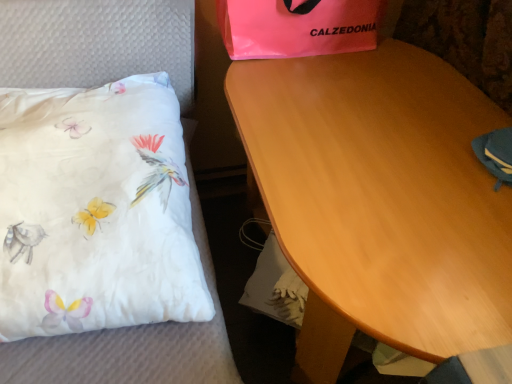
Question: From a real-world perspective, does white satin pillow at left stand above pink plastic bag at upper center?

Choices:
 (A) yes
 (B) no

Answer: (B)

Question: Considering the relative positions of white satin pillow at left and pink plastic bag at upper center in the image provided, is white satin pillow at left to the left of pink plastic bag at upper center from the viewer's perspective?

Choices:
 (A) yes
 (B) no

Answer: (A)

Question: Does white satin pillow at left have a greater height compared to pink plastic bag at upper center?

Choices:
 (A) yes
 (B) no

Answer: (A)

Question: Can pink plastic bag at upper center be found inside white satin pillow at left?

Choices:
 (A) no
 (B) yes

Answer: (A)

Question: Is white satin pillow at left placed right next to pink plastic bag at upper center?

Choices:
 (A) yes
 (B) no

Answer: (B)

Question: From the image's perspective, does white satin pillow at left appear lower than pink plastic bag at upper center?

Choices:
 (A) yes
 (B) no

Answer: (A)

Question: Is wooden table at center oriented towards pink plastic bag at upper center?

Choices:
 (A) yes
 (B) no

Answer: (B)

Question: Is wooden table at center not within pink plastic bag at upper center?

Choices:
 (A) no
 (B) yes

Answer: (B)

Question: Can you confirm if wooden table at center is shorter than pink plastic bag at upper center?

Choices:
 (A) yes
 (B) no

Answer: (B)

Question: Is wooden table at center taller than pink plastic bag at upper center?

Choices:
 (A) yes
 (B) no

Answer: (A)

Question: Can you confirm if wooden table at center is bigger than pink plastic bag at upper center?

Choices:
 (A) yes
 (B) no

Answer: (A)

Question: Would you say wooden table at center contains pink plastic bag at upper center?

Choices:
 (A) yes
 (B) no

Answer: (B)

Question: Is white satin pillow at left closer to the viewer compared to wooden table at center?

Choices:
 (A) no
 (B) yes

Answer: (A)